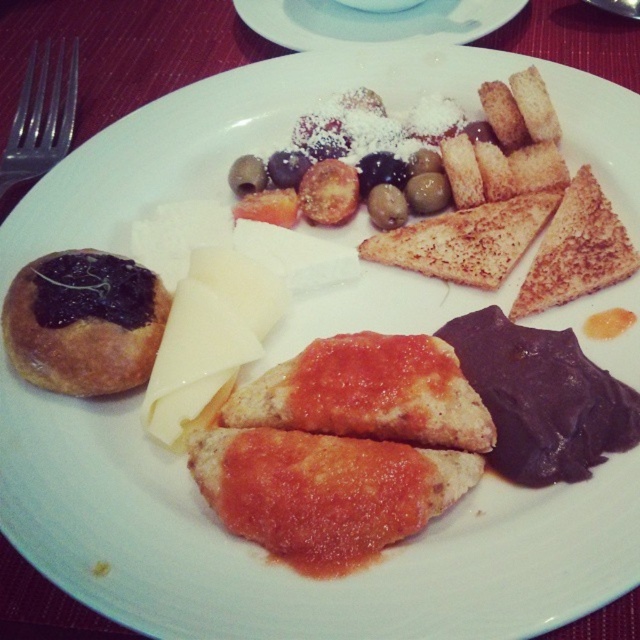
Question: Among these points, which one is nearest to the camera?

Choices:
 (A) (540, 248)
 (B) (253, 4)
 (C) (104, 378)
 (D) (150, 380)

Answer: (D)

Question: Considering the relative positions of golden brown doughnut at left and white ceramic plate at center in the image provided, where is golden brown doughnut at left located with respect to white ceramic plate at center?

Choices:
 (A) right
 (B) left

Answer: (B)

Question: Considering the real-world distances, which object is closest to the white creamy cheese at center?

Choices:
 (A) white ceramic plate at center
 (B) golden brown doughnut at left
 (C) crispy golden-brown toast at upper right

Answer: (B)

Question: Is golden brown doughnut at left wider than white creamy cheese at center?

Choices:
 (A) no
 (B) yes

Answer: (B)

Question: Which object is closer to the camera taking this photo?

Choices:
 (A) crispy golden-brown toast at upper right
 (B) white ceramic plate at center
 (C) white creamy cheese at center
 (D) golden brown doughnut at left

Answer: (C)

Question: Can you confirm if golden brown doughnut at left is positioned above white creamy cheese at center?

Choices:
 (A) yes
 (B) no

Answer: (A)